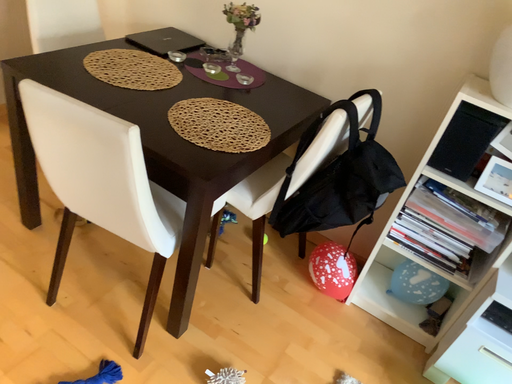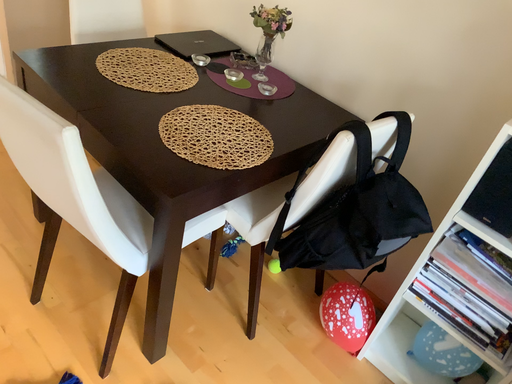
Question: How did the camera likely rotate when shooting the video?

Choices:
 (A) rotated left
 (B) rotated right

Answer: (A)